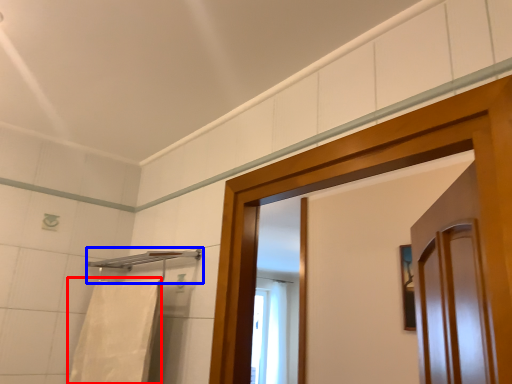
Question: Which object is further to the camera taking this photo, bath towel (highlighted by a red box) or towel bar (highlighted by a blue box)?

Choices:
 (A) bath towel
 (B) towel bar

Answer: (B)